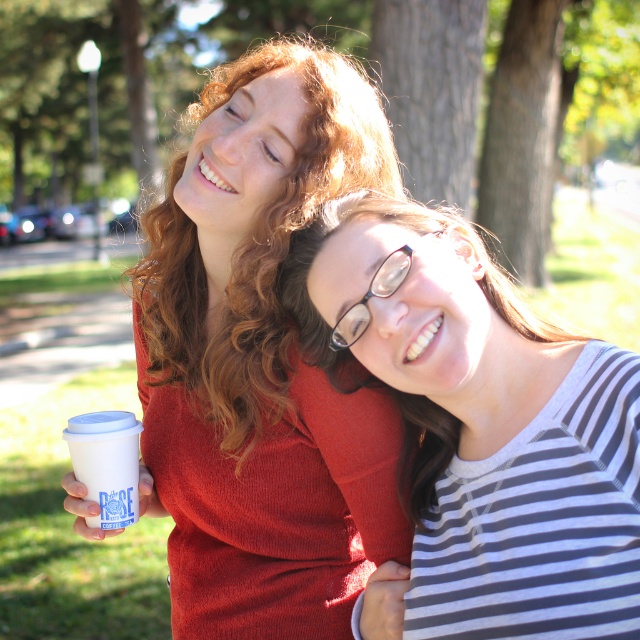
You are a photographer trying to capture a candid shot of the two people in the scene. To avoid including the green leafy tree at upper center in your photo, where should you position yourself relative to the tree?

To avoid including the green leafy tree at upper center in your photo, position yourself below the tree since the tree is located at point (128, 76), which is upper center in the image frame.

You are standing in front of the scene and want to know which of the two points, point (x=472, y=173) or point (x=120, y=493), is closer to you. Can you determine this based on their positions?

Point (x=472, y=173) is further to the viewer than point (x=120, y=493), so the point closer to you is point (x=120, y=493).

You are designing a poster for a cozy coffee shop and want to place the striped fabric shirt at center and the green textured bark at upper center. If you want the shirt to appear wider than the bark, should you adjust the shirt to be wider or narrower?

The striped fabric shirt at center currently has a lesser width compared to the green textured bark at upper center. To make the shirt appear wider, you should adjust the shirt to be wider.